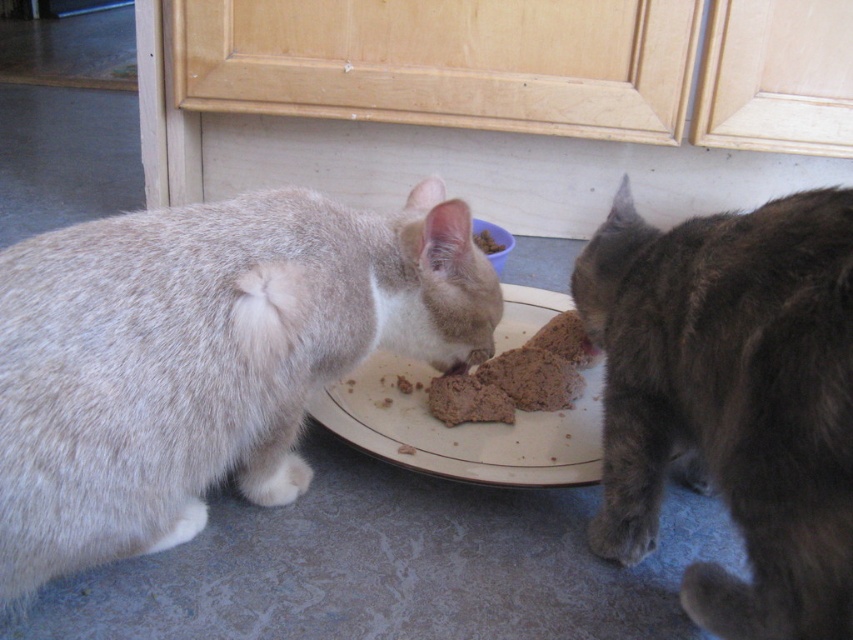
Which of these two, gray fluffy cat at left or white glossy plate at center, stands shorter?

Standing shorter between the two is white glossy plate at center.

Describe the element at coordinates (204, 356) in the screenshot. I see `gray fluffy cat at left` at that location.

Is point (74, 368) farther from viewer compared to point (515, 300)?

No, it is not.

What are the coordinates of `gray fluffy cat at left` in the screenshot? It's located at (204, 356).

Does gray fur cat at right have a greater height compared to brown crumbly food at center?

Yes.

Can you confirm if gray fur cat at right is thinner than brown crumbly food at center?

Yes.

Between point (747, 474) and point (567, 310), which one is positioned in front?

Positioned in front is point (747, 474).

This screenshot has height=640, width=853. I want to click on gray fur cat at right, so click(732, 397).

Between gray fluffy cat at left and gray fur cat at right, which one is positioned higher?

gray fluffy cat at left

Who is positioned more to the left, gray fluffy cat at left or gray fur cat at right?

From the viewer's perspective, gray fluffy cat at left appears more on the left side.

I want to click on gray fluffy cat at left, so click(204, 356).